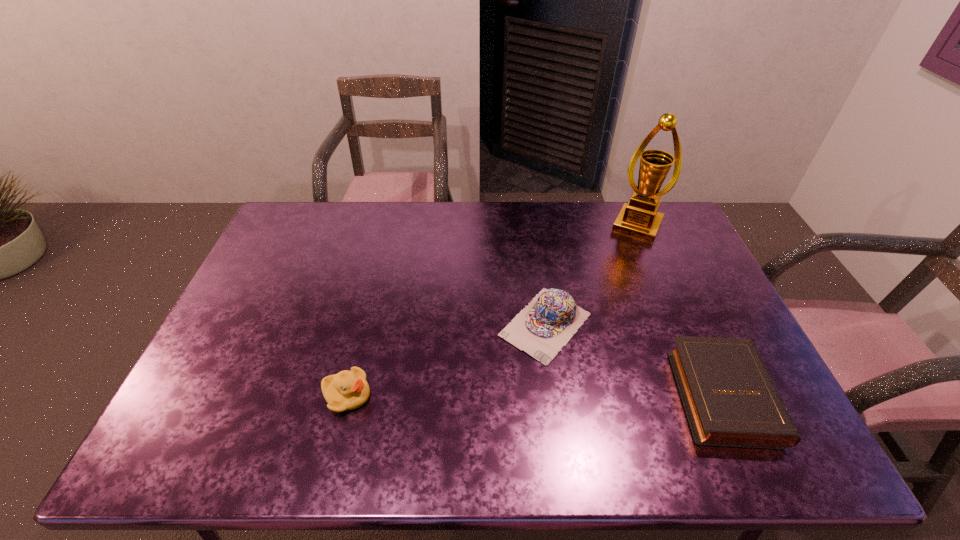
At what (x,y) coordinates should I click in order to perform the action: click on duckling. Please return your answer as a coordinate pair (x, y). The width and height of the screenshot is (960, 540). Looking at the image, I should click on (347, 390).

In order to click on Bible in this screenshot , I will do `click(730, 399)`.

This screenshot has height=540, width=960. I want to click on the tallest object, so click(x=640, y=219).

At what (x,y) coordinates should I click in order to perform the action: click on award. Please return your answer as a coordinate pair (x, y). Looking at the image, I should click on (640, 219).

The width and height of the screenshot is (960, 540). In order to click on the third object from right to left in this screenshot , I will do `click(541, 329)`.

At what (x,y) coordinates should I click in order to perform the action: click on vacant space located 0.280m at the face of the leftmost object. Please return your answer as a coordinate pair (x, y). The width and height of the screenshot is (960, 540). Looking at the image, I should click on (483, 395).

This screenshot has height=540, width=960. Find the location of `free space located on the left of the Bible`. free space located on the left of the Bible is located at coordinates (552, 394).

Locate an element on the screen. The height and width of the screenshot is (540, 960). vacant point located 0.130m on the front-facing side of the award is located at coordinates (620, 264).

Locate an element on the screen. free region located on the front-facing side of the award is located at coordinates (612, 279).

You are a GUI agent. You are given a task and a screenshot of the screen. Output one action in this format:
    pyautogui.click(x=<x>, y=<y>)
    Task: Click on the vacant area located on the front-facing side of the award
    The width and height of the screenshot is (960, 540).
    Given the screenshot: What is the action you would take?
    pyautogui.click(x=612, y=280)